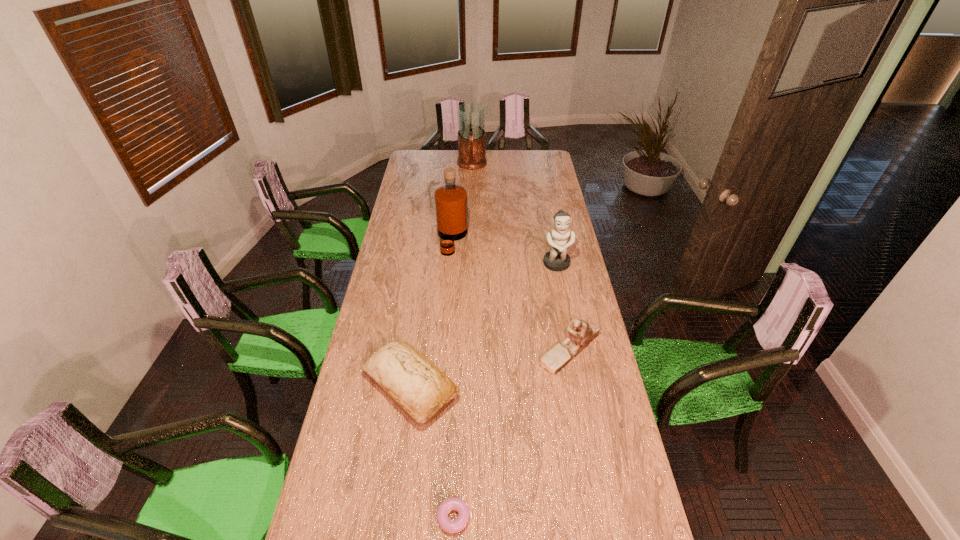
Image resolution: width=960 pixels, height=540 pixels. Find the location of `free spot between the farther figurine and the pitcher`. free spot between the farther figurine and the pitcher is located at coordinates (515, 215).

This screenshot has width=960, height=540. In order to click on vacant area that lies between the taller figurine and the pitcher in this screenshot , I will do `click(515, 215)`.

The height and width of the screenshot is (540, 960). I want to click on vacant region between the shorter figurine and the bread, so click(x=491, y=368).

I want to click on free spot between the liquor and the shortest object, so click(x=451, y=378).

Identify the location of vacant area that lies between the nearest object and the liquor. The image size is (960, 540). (451, 378).

This screenshot has height=540, width=960. I want to click on empty space between the fourth shortest object and the doughnut, so click(503, 391).

What are the coordinates of `free space between the pitcher and the nearer figurine` in the screenshot? It's located at (520, 258).

Image resolution: width=960 pixels, height=540 pixels. I want to click on empty location between the third tallest object and the bread, so click(484, 326).

Locate an element on the screen. vacant area that lies between the nearer figurine and the liquor is located at coordinates (511, 294).

Identify the location of empty location between the taller figurine and the doughnut. (503, 391).